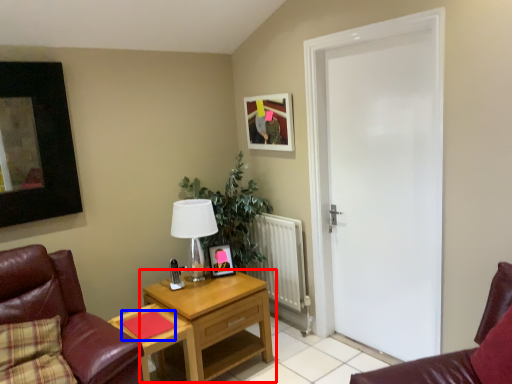
Question: Which object is closer to the camera taking this photo, nightstand (highlighted by a red box) or pad (highlighted by a blue box)?

Choices:
 (A) nightstand
 (B) pad

Answer: (B)